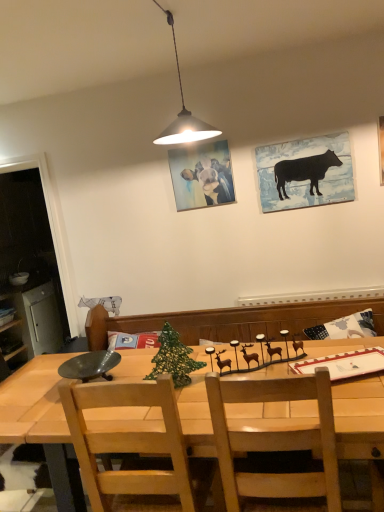
Question: Does wooden table at center have a greater width compared to light brown wooden chair at center?

Choices:
 (A) yes
 (B) no

Answer: (A)

Question: Considering the relative sizes of wooden table at center and light brown wooden chair at center in the image provided, is wooden table at center bigger than light brown wooden chair at center?

Choices:
 (A) yes
 (B) no

Answer: (A)

Question: Does wooden table at center have a smaller size compared to light brown wooden chair at center?

Choices:
 (A) yes
 (B) no

Answer: (B)

Question: From a real-world perspective, does wooden table at center sit lower than light brown wooden chair at center?

Choices:
 (A) no
 (B) yes

Answer: (B)

Question: Are wooden table at center and light brown wooden chair at center located far from each other?

Choices:
 (A) yes
 (B) no

Answer: (B)

Question: Looking at the image, does brushed metal cabinet at left seem bigger or smaller compared to green mesh christmas tree at center?

Choices:
 (A) big
 (B) small

Answer: (A)

Question: Is brushed metal cabinet at left in front of or behind green mesh christmas tree at center in the image?

Choices:
 (A) front
 (B) behind

Answer: (B)

Question: Is point (31, 345) positioned closer to the camera than point (182, 377)?

Choices:
 (A) closer
 (B) farther

Answer: (B)

Question: From the image's perspective, relative to green mesh christmas tree at center, is brushed metal cabinet at left above or below?

Choices:
 (A) above
 (B) below

Answer: (B)

Question: Is black matte cow at upper right, which is the first picture frame in right-to-left order, bigger or smaller than matte oil painting of cow at center, the 1th picture frame from the left?

Choices:
 (A) big
 (B) small

Answer: (A)

Question: Is black matte cow at upper right, which is the first picture frame in right-to-left order, inside the boundaries of matte oil painting of cow at center, which ranks as the second picture frame in right-to-left order, or outside?

Choices:
 (A) inside
 (B) outside

Answer: (B)

Question: From the image's perspective, relative to matte oil painting of cow at center, the 1th picture frame from the left, is black matte cow at upper right, the 2th picture frame in the left-to-right sequence, above or below?

Choices:
 (A) above
 (B) below

Answer: (B)

Question: Based on their positions, is black matte cow at upper right, which is the first picture frame in right-to-left order, located to the left or right of matte oil painting of cow at center, which ranks as the second picture frame in right-to-left order?

Choices:
 (A) right
 (B) left

Answer: (A)

Question: From a real-world perspective, is light brown wooden chair at center above or below green mesh christmas tree at center?

Choices:
 (A) above
 (B) below

Answer: (B)

Question: Considering their positions, is light brown wooden chair at center located in front of or behind green mesh christmas tree at center?

Choices:
 (A) behind
 (B) front

Answer: (B)